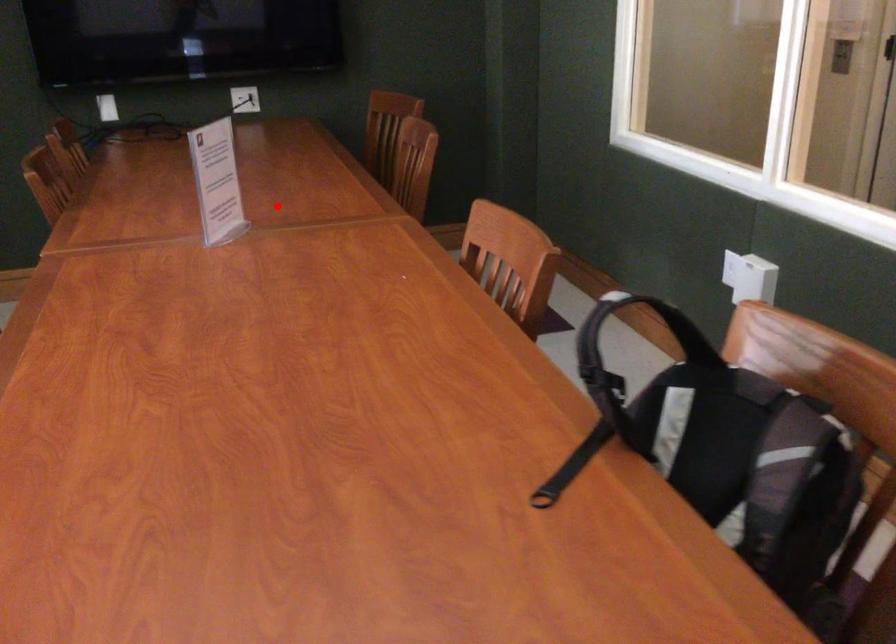
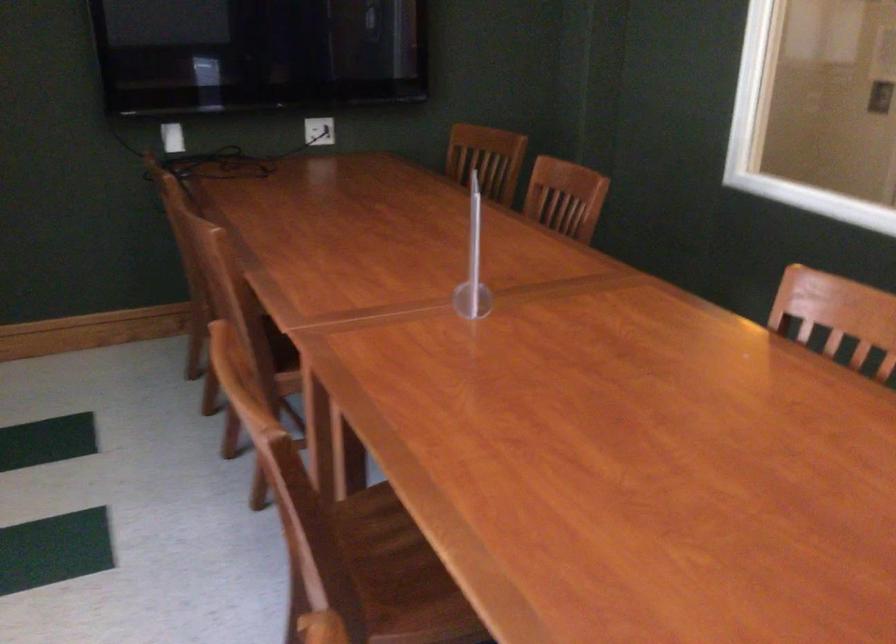
Question: I am providing you with two images of the same scene from different viewpoints. Given a red point in image1, look at the same physical point in image2. Is it:

Choices:
 (A) Closer to the viewpoint
 (B) Farther from the viewpoint

Answer: (A)